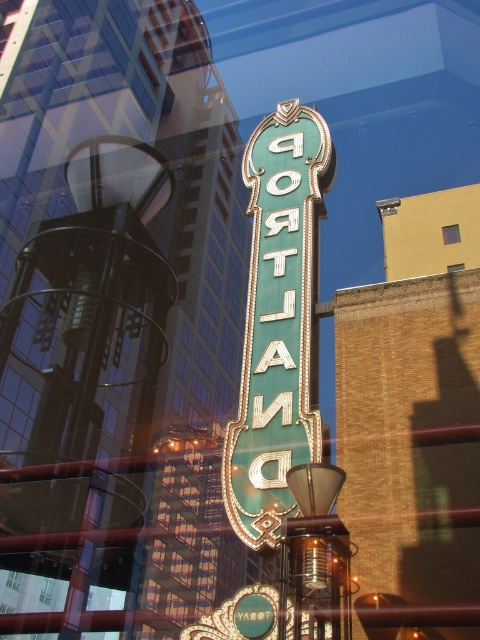
Question: Observing the image, what is the correct spatial positioning of green metallic sign at center in reference to blue glass window at center?

Choices:
 (A) below
 (B) above

Answer: (A)

Question: Which object is closer to the camera taking this photo?

Choices:
 (A) green metallic sign at center
 (B) blue glass window at center

Answer: (A)

Question: Is green metallic sign at center further to the viewer compared to blue glass window at center?

Choices:
 (A) yes
 (B) no

Answer: (B)

Question: Can you confirm if green metallic sign at center is bigger than blue glass window at center?

Choices:
 (A) yes
 (B) no

Answer: (A)

Question: Which of the following is the closest to the observer?

Choices:
 (A) (322, 157)
 (B) (446, 234)

Answer: (A)